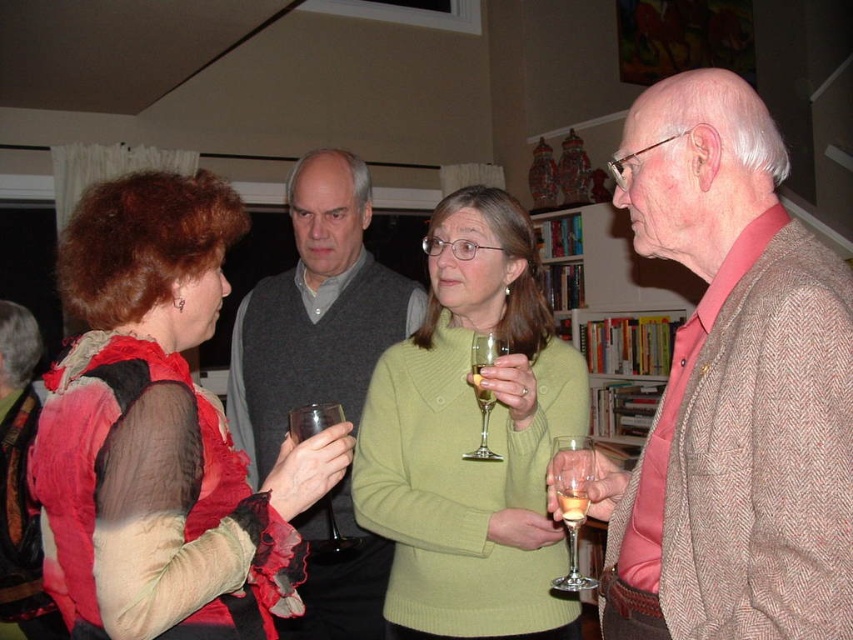
You are at a social gathering and want to pour yourself a glass of wine. The clear glass wine glass at lower right is located at point (572, 502). Where should you go to find the wine bottle?

The clear glass wine glass at lower right is located at point (572, 502). Since the wine bottle is typically near the glasses, you should check the area around that point for a wine bottle.

You are a photographer trying to capture a candid shot of the dark gray sweater at center and the clear glass wine glass at lower right. Since the wine glass is partially obscured, can you adjust your angle to focus on both objects without moving them?

The dark gray sweater at center is positioned over the clear glass wine glass at lower right, so adjusting your angle might allow you to focus on both objects without moving them by capturing the sweater above and the wine glass below.